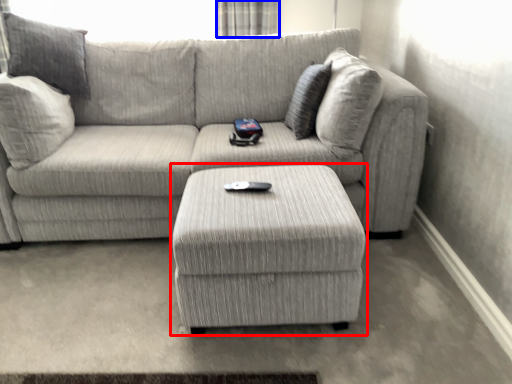
Question: Which point is closer to the camera, table (highlighted by a red box) or curtain (highlighted by a blue box)?

Choices:
 (A) table
 (B) curtain

Answer: (A)